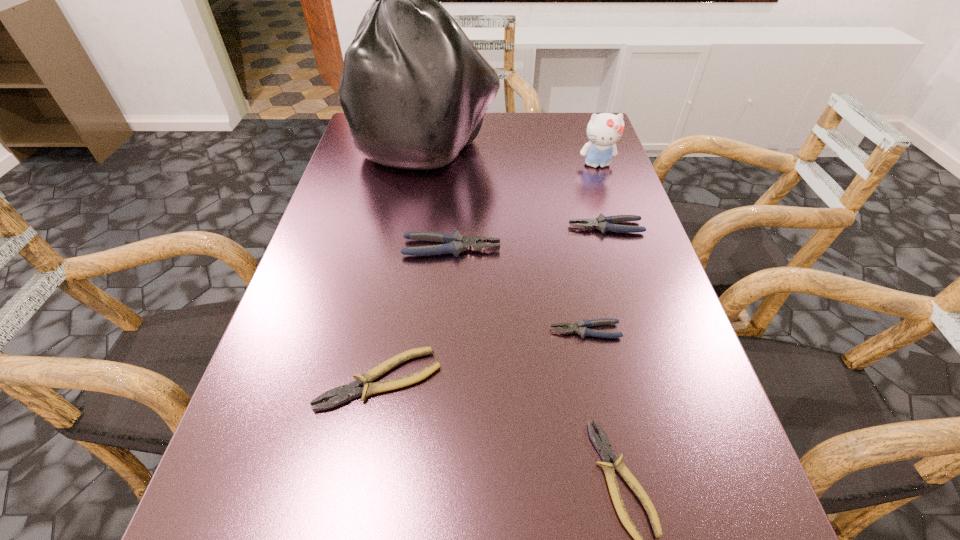
The height and width of the screenshot is (540, 960). I want to click on the tallest object, so click(x=414, y=90).

Find the location of `the sixth shortest object`. the sixth shortest object is located at coordinates (604, 130).

Where is `the second farthest pliers`? the second farthest pliers is located at coordinates (456, 243).

You are a GUI agent. You are given a task and a screenshot of the screen. Output one action in this format:
    pyautogui.click(x=<x>, y=<y>)
    Task: Click on the fifth shortest object
    
    Given the screenshot: What is the action you would take?
    pos(456,243)

This screenshot has height=540, width=960. Identify the location of the third farthest object. (602, 223).

At what (x,y) coordinates should I click in order to perform the action: click on the farthest gray pliers. Please return your answer as a coordinate pair (x, y). Looking at the image, I should click on (602, 223).

This screenshot has height=540, width=960. Find the location of `the left yellow pliers`. the left yellow pliers is located at coordinates (346, 392).

Locate an element on the screen. This screenshot has width=960, height=540. the second nearest object is located at coordinates (346, 392).

I want to click on the smallest gray pliers, so click(x=580, y=327).

You are a GUI agent. You are given a task and a screenshot of the screen. Output one action in this format:
    pyautogui.click(x=<x>, y=<y>)
    Task: Click on the third nearest object
    
    Given the screenshot: What is the action you would take?
    pyautogui.click(x=580, y=327)